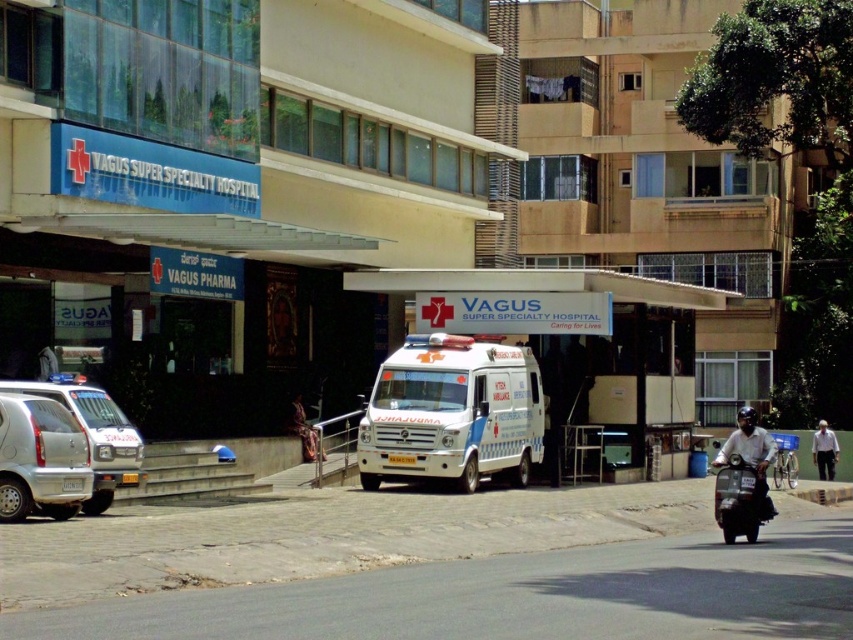
You are a patient arriving at the VAGUS SUPER SPECIALTY HOSPITAL. You see a dark gray helmeted head at lower right and a white cotton shirt at lower right. Which object is located more to the left?

The dark gray helmeted head at lower right is positioned on the left side of white cotton shirt at lower right, so the dark gray helmeted head at lower right is more to the left.

You are a delivery driver who needs to park your vehicle near the VAGUS SUPER SPECIALTY HOSPITAL entrance. There is a silver metallic van at left and a white cotton shirt at lower right in the scene. Which parking spot is more spacious for your vehicle?

The silver metallic van at left is bigger than the white cotton shirt at lower right, so the parking spot near the silver metallic van at left is more spacious for your vehicle.